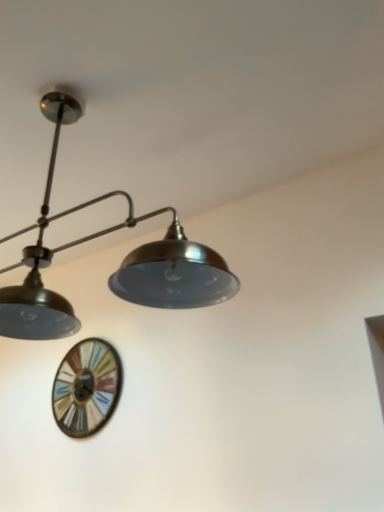
What do you see at coordinates (86, 388) in the screenshot?
I see `wooden wall clock at lower left` at bounding box center [86, 388].

Measure the distance between wooden wall clock at lower left and camera.

wooden wall clock at lower left is 8.15 feet from camera.

Image resolution: width=384 pixels, height=512 pixels. In order to click on wooden wall clock at lower left in this screenshot , I will do `click(86, 388)`.

Locate an element on the screen. The image size is (384, 512). wooden wall clock at lower left is located at coordinates (86, 388).